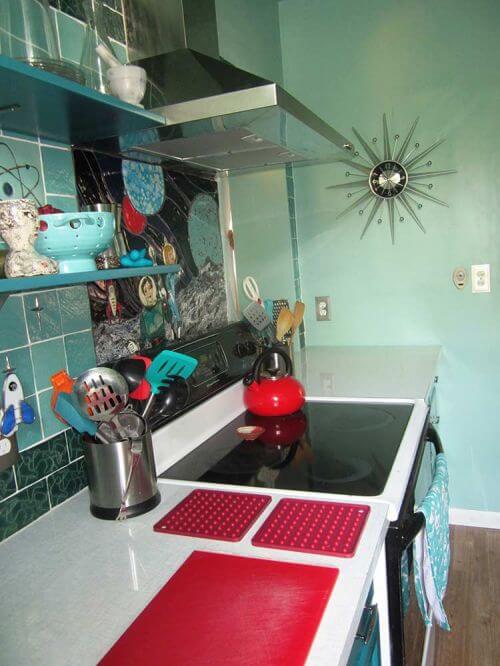
Where is `dish mat`? This screenshot has width=500, height=666. dish mat is located at coordinates (313, 533), (221, 515).